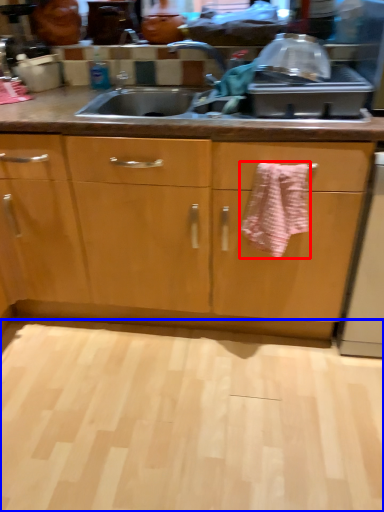
Question: Which of the following is the farthest to the observer, bath towel (highlighted by a red box) or plain (highlighted by a blue box)?

Choices:
 (A) bath towel
 (B) plain

Answer: (A)